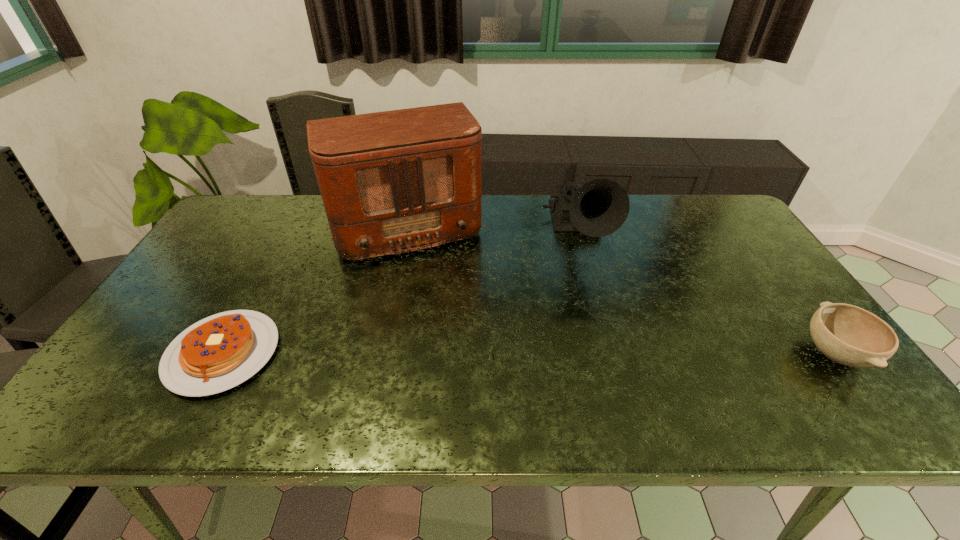
Where is `the shortest object`? the shortest object is located at coordinates (219, 352).

At what (x,y) coordinates should I click in order to perform the action: click on the second shortest object. Please return your answer as a coordinate pair (x, y). The height and width of the screenshot is (540, 960). Looking at the image, I should click on (846, 334).

The height and width of the screenshot is (540, 960). I want to click on the rightmost object, so pos(846,334).

Locate an element on the screen. phonograph_record is located at coordinates (599, 207).

The image size is (960, 540). What are the coordinates of `the third object from left to right` in the screenshot? It's located at pyautogui.click(x=599, y=207).

Where is `radio receiver`? This screenshot has width=960, height=540. radio receiver is located at coordinates (391, 182).

I want to click on vacant area situated 0.380m on the back of the pancake, so click(x=291, y=227).

The width and height of the screenshot is (960, 540). I want to click on vacant space situated on the left of the second shortest object, so click(x=696, y=353).

Locate an element on the screen. vacant space located 0.260m from the horn of the second object from right to left is located at coordinates (607, 347).

Locate an element on the screen. free region located from the horn of the second object from right to left is located at coordinates 612,367.